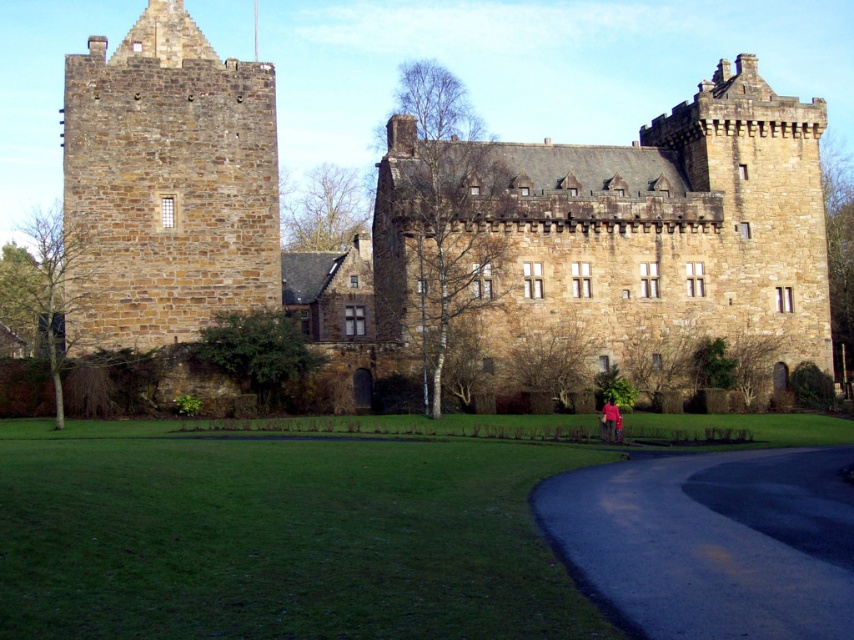
Question: Which object is closer to the camera taking this photo?

Choices:
 (A) dark asphalt road at lower right
 (B) brown stone castle at upper center
 (C) brown stone tower at left

Answer: (A)

Question: Can you confirm if brown stone castle at upper center is positioned below brown stone tower at left?

Choices:
 (A) yes
 (B) no

Answer: (A)

Question: Which is farther from the pink fabric at lower center?

Choices:
 (A) dark asphalt road at lower right
 (B) brown stone tower at left
 (C) brown stone castle at upper center

Answer: (B)

Question: Which point appears farthest from the camera in this image?

Choices:
 (A) (758, 515)
 (B) (609, 413)
 (C) (264, 113)
 (D) (706, 116)

Answer: (D)

Question: Can you confirm if brown stone tower at left is positioned above pink fabric at lower center?

Choices:
 (A) no
 (B) yes

Answer: (B)

Question: Can you confirm if dark asphalt road at lower right is smaller than pink fabric at lower center?

Choices:
 (A) yes
 (B) no

Answer: (B)